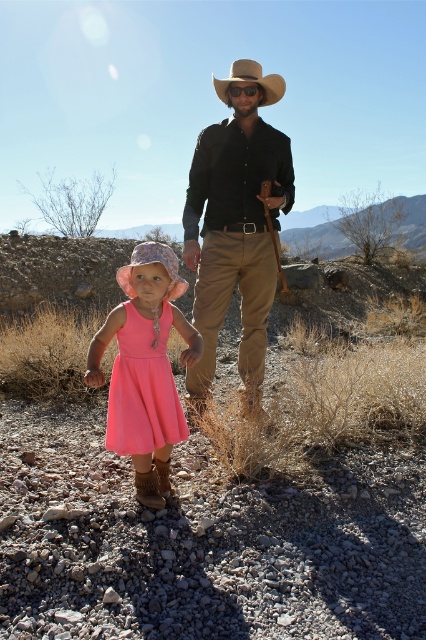
Question: Does pink fabric dress at center appear under pink fabric dress at lower left?

Choices:
 (A) no
 (B) yes

Answer: (A)

Question: Which of these objects is positioned closest to the pink fabric cowboy hat at center?

Choices:
 (A) matte black shirt at center
 (B) pink fabric dress at center
 (C) pink fabric dress at lower left

Answer: (B)

Question: Estimate the real-world distances between objects in this image. Which object is closer to the pink fabric dress at center?

Choices:
 (A) pink fabric dress at lower left
 (B) matte black shirt at center
 (C) brown felt cowboy hat at center

Answer: (A)

Question: Is matte black shirt at center positioned at the back of brown felt cowboy hat at center?

Choices:
 (A) no
 (B) yes

Answer: (A)

Question: Is pink fabric dress at lower left bigger than pink fabric cowboy hat at center?

Choices:
 (A) yes
 (B) no

Answer: (A)

Question: Among these points, which one is farthest from the camera?

Choices:
 (A) (138, 252)
 (B) (229, 257)
 (C) (244, 77)

Answer: (B)